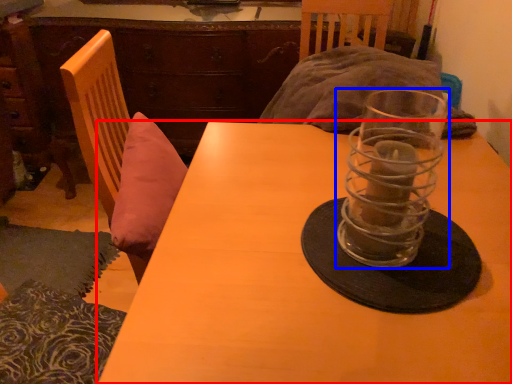
Question: Among these objects, which one is nearest to the camera, table (highlighted by a red box) or tableware (highlighted by a blue box)?

Choices:
 (A) table
 (B) tableware

Answer: (A)